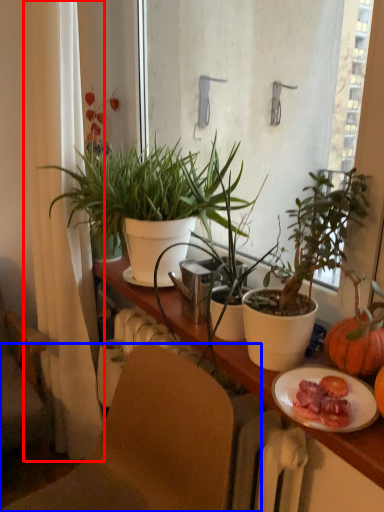
Question: Which of the following is the closest to the observer, curtain (highlighted by a red box) or chair (highlighted by a blue box)?

Choices:
 (A) curtain
 (B) chair

Answer: (B)